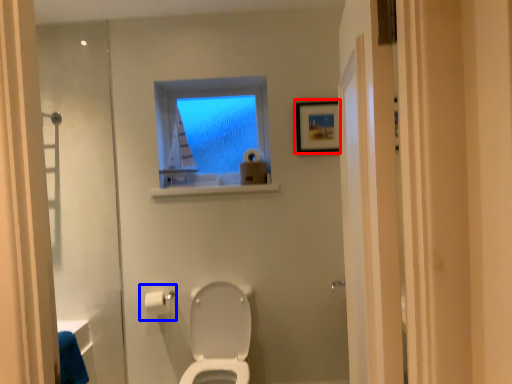
Question: Which object is closer to the camera taking this photo, picture frame (highlighted by a red box) or toilet paper (highlighted by a blue box)?

Choices:
 (A) picture frame
 (B) toilet paper

Answer: (B)